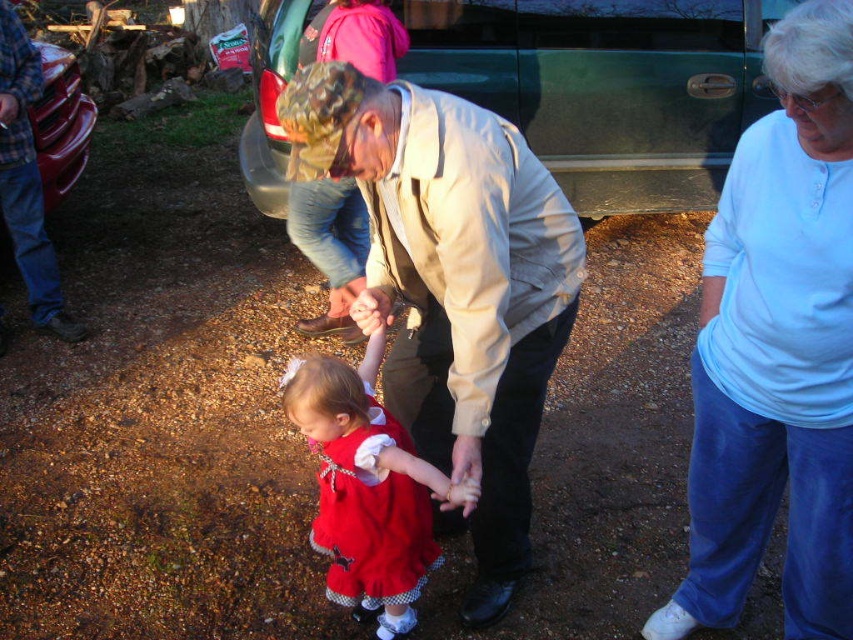
Measure the distance between white cotton shirt at right and brushed metal bumper at left.

white cotton shirt at right and brushed metal bumper at left are 3.25 meters apart.

Locate an element on the screen. This screenshot has width=853, height=640. white cotton shirt at right is located at coordinates (776, 349).

Is light beige jacket at center below brushed metal bumper at left?

Indeed, light beige jacket at center is positioned under brushed metal bumper at left.

You are a GUI agent. You are given a task and a screenshot of the screen. Output one action in this format:
    pyautogui.click(x=<x>, y=<y>)
    Task: Click on the light beige jacket at center
    
    Given the screenshot: What is the action you would take?
    pyautogui.click(x=453, y=284)

Is point (827, 13) less distant than point (316, 474)?

Yes.

Is white cotton shirt at right positioned in front of matte red dress at center?

Yes.

What do you see at coordinates (776, 349) in the screenshot?
I see `white cotton shirt at right` at bounding box center [776, 349].

The image size is (853, 640). I want to click on white cotton shirt at right, so click(x=776, y=349).